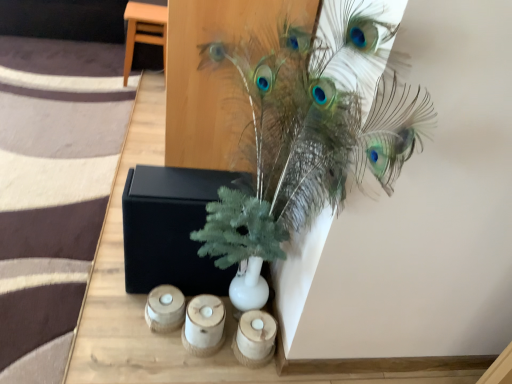
The height and width of the screenshot is (384, 512). Find the location of `vacant area on top of black matte box at center (from a real-world perspective)`. vacant area on top of black matte box at center (from a real-world perspective) is located at coordinates (183, 179).